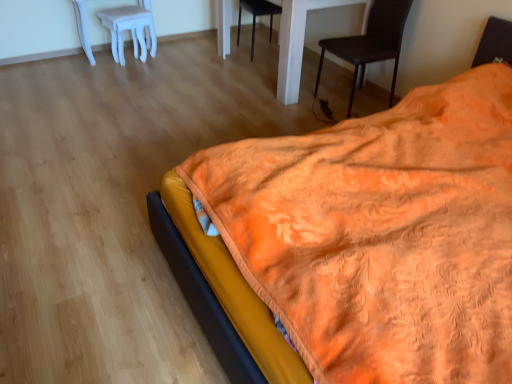
The width and height of the screenshot is (512, 384). What do you see at coordinates (298, 41) in the screenshot? I see `white glossy table at center` at bounding box center [298, 41].

This screenshot has width=512, height=384. What do you see at coordinates (371, 42) in the screenshot?
I see `black leather chair at upper right, which appears as the second chair when viewed from the left` at bounding box center [371, 42].

At what (x,y) coordinates should I click in order to perform the action: click on black leather chair at upper right, which is the 1th chair in right-to-left order. Please return your answer as a coordinate pair (x, y). This screenshot has height=384, width=512. Looking at the image, I should click on (371, 42).

The height and width of the screenshot is (384, 512). Describe the element at coordinates (221, 295) in the screenshot. I see `orange textured blanket at lower right` at that location.

Image resolution: width=512 pixels, height=384 pixels. I want to click on white glossy table at center, so pos(298,41).

Would you say black matte chair at center, arranged as the 2th chair when viewed from the right, is outside white plastic stool at upper left?

Yes, black matte chair at center, arranged as the 2th chair when viewed from the right, is outside of white plastic stool at upper left.

Is black matte chair at center, the 1th chair viewed from the left, positioned before white plastic stool at upper left?

No, it is behind white plastic stool at upper left.

From the image's perspective, which one is positioned lower, black matte chair at center, the 1th chair viewed from the left, or white plastic stool at upper left?

white plastic stool at upper left.

How many degrees apart are the facing directions of black matte chair at center, acting as the second chair starting from the front, and black leather chair at upper right, which is the 1th chair in right-to-left order?

They differ by 86.2 degrees in their facing directions.

Is black matte chair at center, acting as the 1th chair starting from the back, aimed at black leather chair at upper right, which appears as the second chair when viewed from the left?

Yes, black matte chair at center, acting as the 1th chair starting from the back, is aimed at black leather chair at upper right, which appears as the second chair when viewed from the left.

Which object is further away from the camera taking this photo, black matte chair at center, arranged as the 2th chair when viewed from the right, or black leather chair at upper right, which is the 1th chair in right-to-left order?

black matte chair at center, arranged as the 2th chair when viewed from the right, is further away from the camera.

In the scene shown: Which is behind, white glossy table at center or black matte chair at center, acting as the 1th chair starting from the back?

black matte chair at center, acting as the 1th chair starting from the back.

Consider the image. From the image's perspective, between white glossy table at center and black matte chair at center, acting as the 1th chair starting from the back, which one is located above?

black matte chair at center, acting as the 1th chair starting from the back, from the image's perspective.

Where is `chair below the white glossy table at center (from a real-world perspective)`? chair below the white glossy table at center (from a real-world perspective) is located at coordinates (257, 15).

Visually, is white glossy table at center positioned to the left or to the right of black matte chair at center, the 1th chair viewed from the left?

white glossy table at center is to the right of black matte chair at center, the 1th chair viewed from the left.

Does black leather chair at upper right, which appears as the first chair when viewed from the front, turn towards orange textured blanket at lower right?

No, black leather chair at upper right, which appears as the first chair when viewed from the front, is not facing towards orange textured blanket at lower right.

Is black leather chair at upper right, which appears as the first chair when viewed from the front, to the left or to the right of orange textured blanket at lower right in the image?

black leather chair at upper right, which appears as the first chair when viewed from the front, is to the right of orange textured blanket at lower right.

From a real-world perspective, which is physically below, black leather chair at upper right, which appears as the second chair when viewed from the left, or orange textured blanket at lower right?

black leather chair at upper right, which appears as the second chair when viewed from the left.

Which object is wider, black leather chair at upper right, which appears as the first chair when viewed from the front, or orange textured blanket at lower right?

orange textured blanket at lower right is wider.

Is orange textured blanket at lower right oriented towards white plastic stool at upper left?

No, orange textured blanket at lower right is not turned towards white plastic stool at upper left.

In the scene shown: From the image's perspective, which one is positioned lower, orange textured blanket at lower right or white plastic stool at upper left?

orange textured blanket at lower right appears lower in the image.

Is orange textured blanket at lower right located outside white plastic stool at upper left?

Absolutely, orange textured blanket at lower right is external to white plastic stool at upper left.

Is orange textured blanket at lower right wider than white plastic stool at upper left?

Correct, the width of orange textured blanket at lower right exceeds that of white plastic stool at upper left.

Considering the relative sizes of white glossy table at center and orange textured blanket at lower right in the image provided, is white glossy table at center smaller than orange textured blanket at lower right?

Yes.

From the picture: Could you tell me if white glossy table at center is turned towards orange textured blanket at lower right?

No, white glossy table at center is not aimed at orange textured blanket at lower right.

Measure the distance between white glossy table at center and orange textured blanket at lower right.

white glossy table at center and orange textured blanket at lower right are 1.93 meters apart.

Is white glossy table at center touching orange textured blanket at lower right?

No, white glossy table at center is not in contact with orange textured blanket at lower right.

Based on the photo, which object is further away from the camera taking this photo, black leather chair at upper right, which ranks as the 2th chair in back-to-front order, or white glossy table at center?

white glossy table at center.

Which is in front, point (373, 24) or point (297, 69)?

The point (373, 24) is in front.

Is black leather chair at upper right, which appears as the first chair when viewed from the front, placed right next to white glossy table at center?

They are not placed beside each other.

What's the angular difference between black leather chair at upper right, which is the 1th chair in right-to-left order, and white glossy table at center's facing directions?

There is a 0.694-degree angle between the facing directions of black leather chair at upper right, which is the 1th chair in right-to-left order, and white glossy table at center.

The width and height of the screenshot is (512, 384). I want to click on stool that is under the black matte chair at center, acting as the second chair starting from the front (from a real-world perspective), so click(130, 29).

Where is `chair lying in front of the black matte chair at center, acting as the second chair starting from the front`? chair lying in front of the black matte chair at center, acting as the second chair starting from the front is located at coordinates (371, 42).

Which object lies further to the anchor point orange textured blanket at lower right, white glossy table at center or black matte chair at center, acting as the second chair starting from the front?

black matte chair at center, acting as the second chair starting from the front.

From the image, which object appears to be nearer to black matte chair at center, acting as the 1th chair starting from the back, black leather chair at upper right, which appears as the first chair when viewed from the front, or orange textured blanket at lower right?

black leather chair at upper right, which appears as the first chair when viewed from the front, is positioned closer to the anchor black matte chair at center, acting as the 1th chair starting from the back.

Considering their positions, is white glossy table at center positioned further to black leather chair at upper right, which appears as the second chair when viewed from the left, than orange textured blanket at lower right?

Based on the image, orange textured blanket at lower right appears to be further to black leather chair at upper right, which appears as the second chair when viewed from the left.

Looking at this image, from the image, which object appears to be nearer to orange textured blanket at lower right, black leather chair at upper right, which is the 1th chair in right-to-left order, or white glossy table at center?

The object closer to orange textured blanket at lower right is white glossy table at center.

From the image, which object appears to be nearer to white glossy table at center, black matte chair at center, acting as the second chair starting from the front, or orange textured blanket at lower right?

The object closer to white glossy table at center is black matte chair at center, acting as the second chair starting from the front.

Estimate the real-world distances between objects in this image. Which object is further from black leather chair at upper right, which ranks as the 2th chair in back-to-front order, black matte chair at center, acting as the 1th chair starting from the back, or white plastic stool at upper left?

Based on the image, white plastic stool at upper left appears to be further to black leather chair at upper right, which ranks as the 2th chair in back-to-front order.

Which object lies nearer to the anchor point white glossy table at center, black matte chair at center, acting as the second chair starting from the front, or white plastic stool at upper left?

black matte chair at center, acting as the second chair starting from the front.

Estimate the real-world distances between objects in this image. Which object is closer to white glossy table at center, orange textured blanket at lower right or black matte chair at center, arranged as the 2th chair when viewed from the right?

black matte chair at center, arranged as the 2th chair when viewed from the right, is positioned closer to the anchor white glossy table at center.

The image size is (512, 384). In order to click on chair between orange textured blanket at lower right and white plastic stool at upper left along the z-axis in this screenshot , I will do `click(371, 42)`.

Identify the location of chair between white plastic stool at upper left and black leather chair at upper right, which appears as the first chair when viewed from the front, in the horizontal direction. (257, 15).

Where is `table between orange textured blanket at lower right and white plastic stool at upper left along the z-axis`? The width and height of the screenshot is (512, 384). table between orange textured blanket at lower right and white plastic stool at upper left along the z-axis is located at coordinates (298, 41).

Where is `table between white plastic stool at upper left and black leather chair at upper right, which appears as the first chair when viewed from the front, in the horizontal direction`? table between white plastic stool at upper left and black leather chair at upper right, which appears as the first chair when viewed from the front, in the horizontal direction is located at coordinates point(298,41).